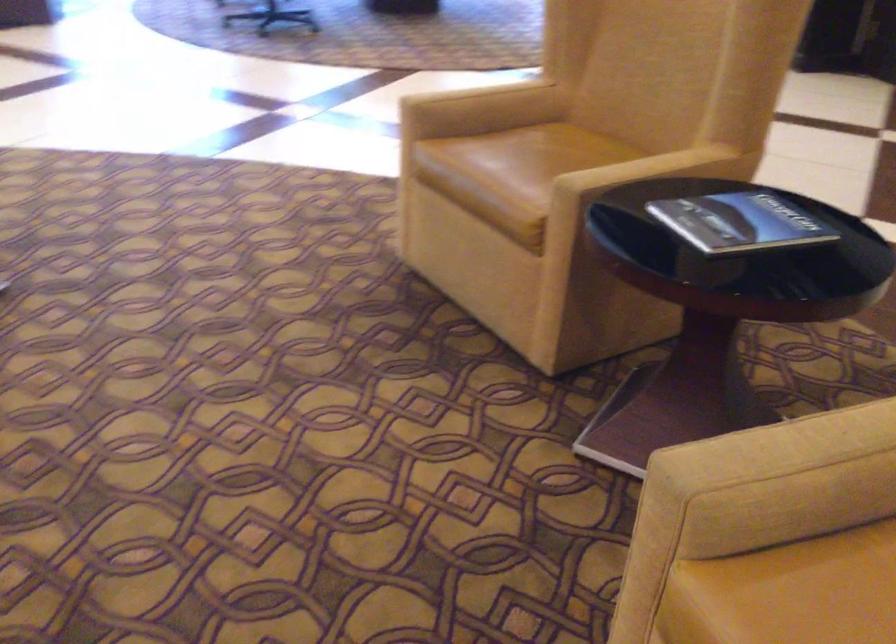
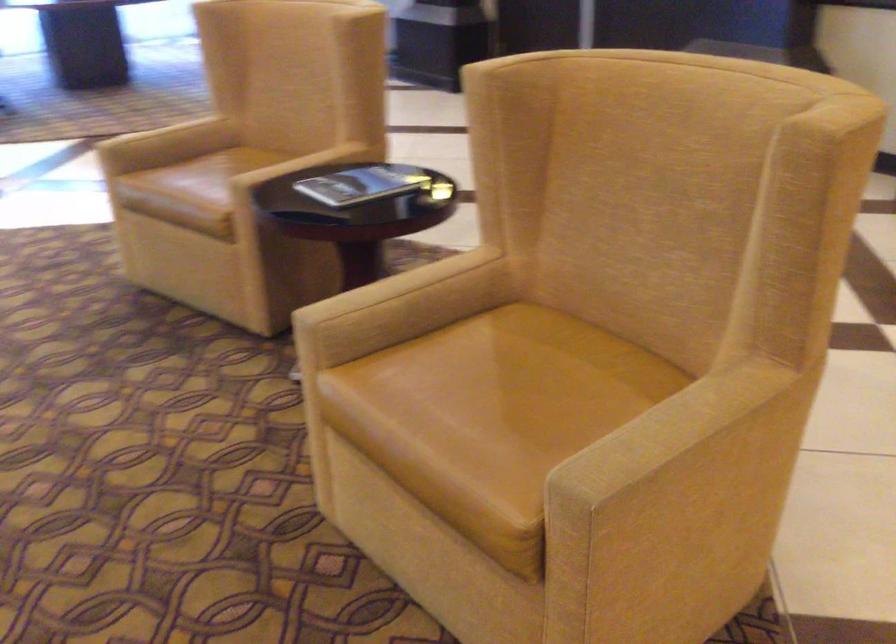
Where in the second image is the point corresponding to [797,418] from the first image?

(394, 286)